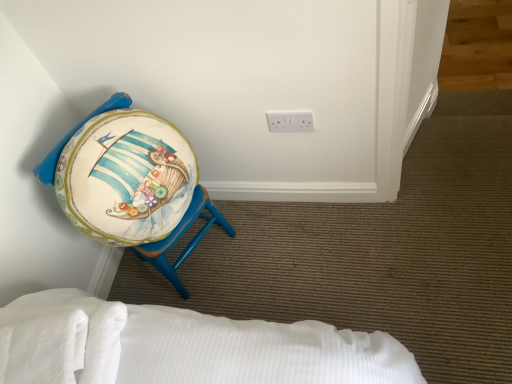
Locate an element on the screen. Image resolution: width=512 pixels, height=384 pixels. free spot in front of matte painted stool at left is located at coordinates (231, 293).